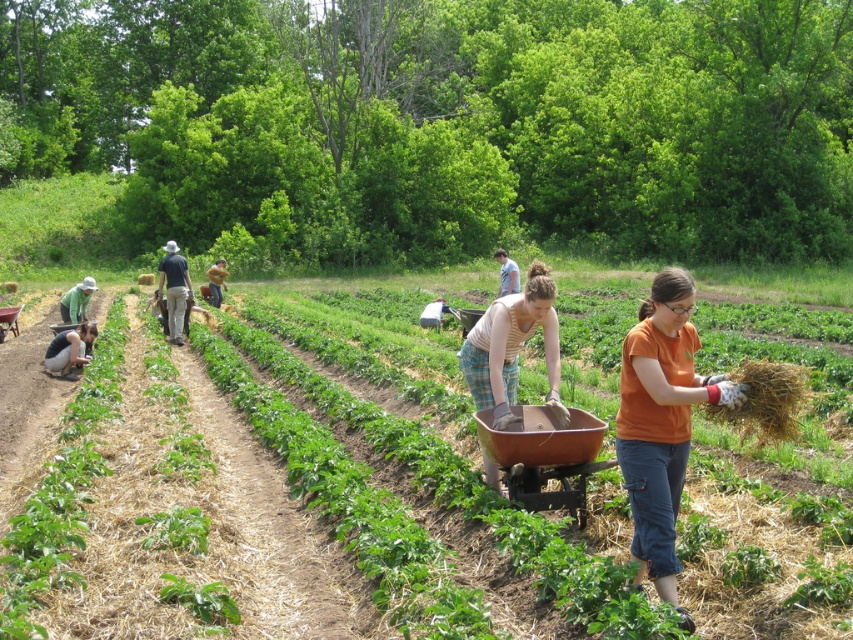
Does striped cotton shirt at center appear on the left side of green fabric shirt at left?

Incorrect, striped cotton shirt at center is not on the left side of green fabric shirt at left.

How much distance is there between striped cotton shirt at center and green fabric shirt at left?

striped cotton shirt at center and green fabric shirt at left are 10.32 meters apart.

Is point (543, 282) positioned after point (64, 321)?

No, it is in front of (64, 321).

Identify the location of striped cotton shirt at center. The height and width of the screenshot is (640, 853). (512, 346).

Between striped cotton shirt at center and light blue shirt at center, which one is positioned lower?

striped cotton shirt at center

Image resolution: width=853 pixels, height=640 pixels. What do you see at coordinates (512, 346) in the screenshot? I see `striped cotton shirt at center` at bounding box center [512, 346].

Image resolution: width=853 pixels, height=640 pixels. Identify the location of striped cotton shirt at center. (512, 346).

Locate an element on the screen. The image size is (853, 640). striped cotton shirt at center is located at coordinates tap(512, 346).

Is green fabric at lower left positioned in front of light blue shirt at center?

Yes, green fabric at lower left is closer to the viewer.

Between green fabric at lower left and light blue shirt at center, which one appears on the left side from the viewer's perspective?

Positioned to the left is green fabric at lower left.

Which is in front, point (56, 352) or point (502, 289)?

Positioned in front is point (56, 352).

Identify the location of green fabric at lower left. (70, 349).